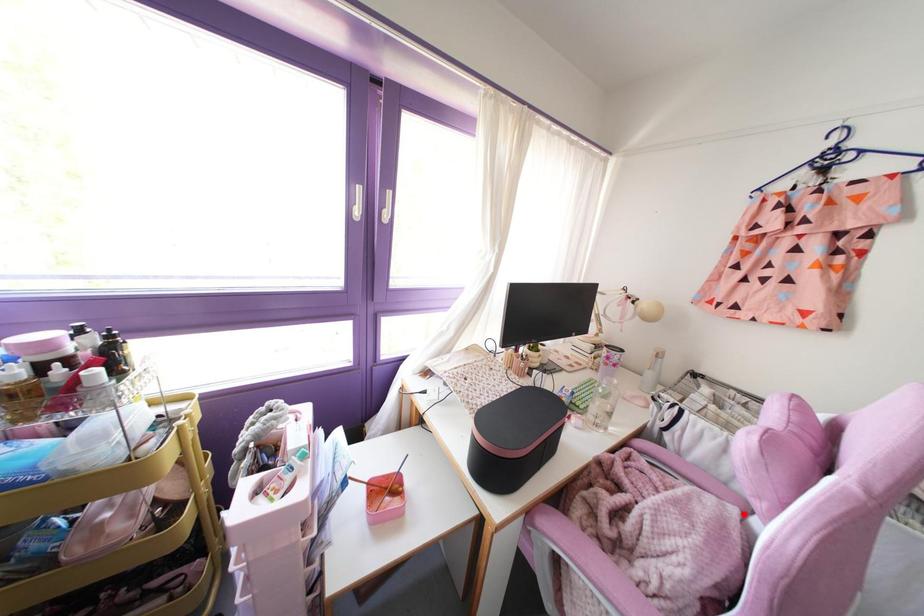
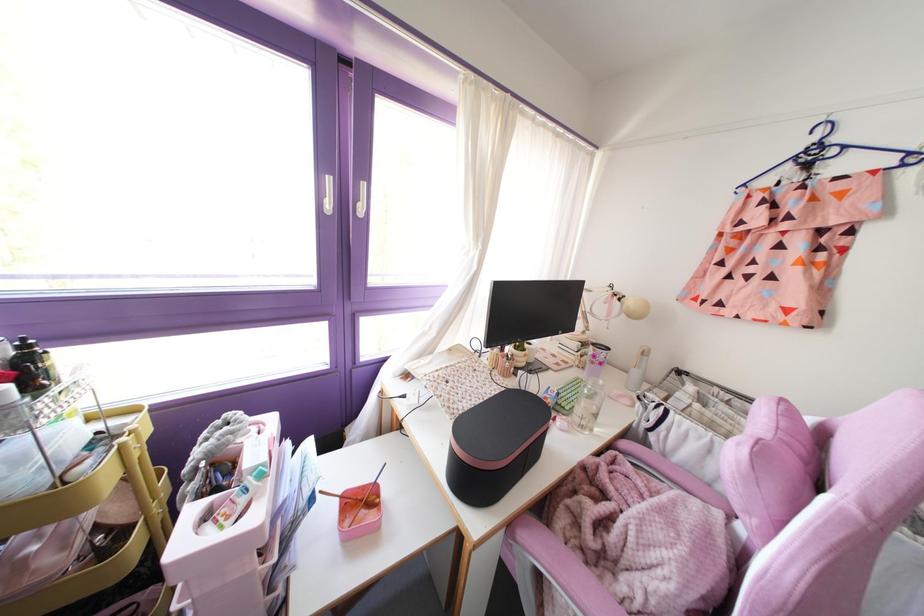
Find the pixel in the second image that matches the highlighted location in the first image.

(727, 517)